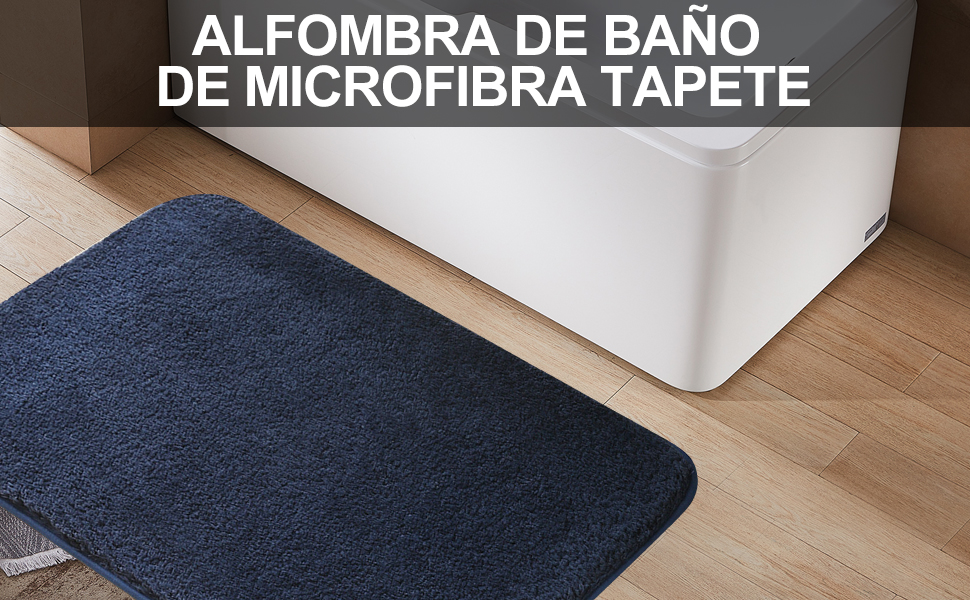
The image size is (970, 600). Identify the location of bath mat. (390, 456).